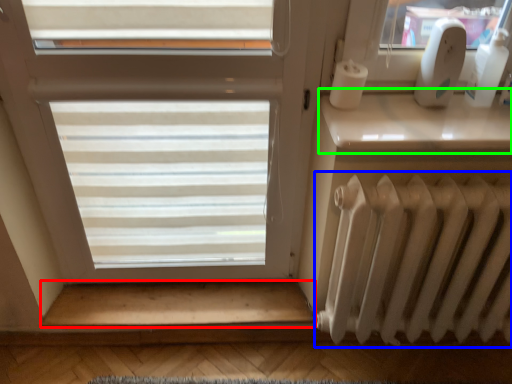
Question: Considering the real-world distances, which object is farthest from stairwell (highlighted by a red box)? radiator (highlighted by a blue box) or window sill (highlighted by a green box)?

Choices:
 (A) radiator
 (B) window sill

Answer: (B)